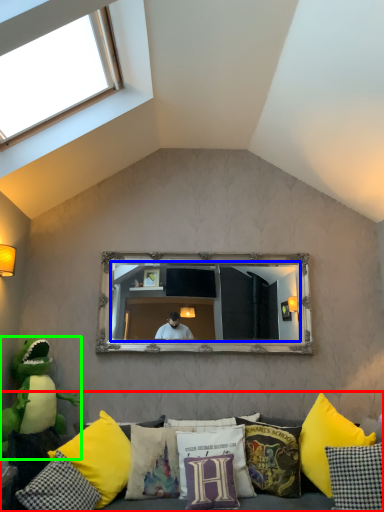
Question: Which object is positioned farthest from studio couch (highlighted by a red box)? Select from mirror (highlighted by a blue box) and toy (highlighted by a green box).

Choices:
 (A) mirror
 (B) toy

Answer: (A)